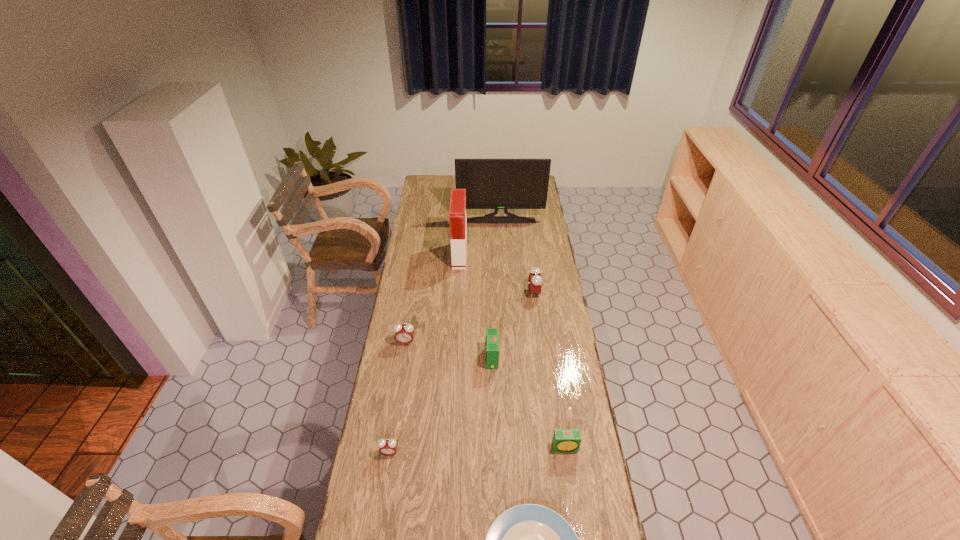
I want to click on vacant space positioned on the front-facing side of the third alarm clock from right to left, so click(x=451, y=358).

This screenshot has height=540, width=960. In order to click on free space located 0.050m on the clock face of the nearest pink alarm clock in this screenshot , I will do `click(387, 472)`.

Identify the location of free spot located 0.200m on the front-facing side of the right green alarm clock. This screenshot has height=540, width=960. (576, 516).

Image resolution: width=960 pixels, height=540 pixels. Find the location of `monitor situated at the right edge`. monitor situated at the right edge is located at coordinates (496, 184).

I want to click on blank space at the left edge, so click(x=388, y=417).

In the image, there is a desktop. At what (x,y) coordinates should I click in order to perform the action: click on vacant space at the right edge. Please return your answer as a coordinate pair (x, y). This screenshot has width=960, height=540. Looking at the image, I should click on (529, 210).

Locate an element on the screen. free space at the far left corner is located at coordinates (422, 183).

The image size is (960, 540). I want to click on vacant point located between the cigarette_case and the third farthest object, so click(497, 274).

You are a GUI agent. You are given a task and a screenshot of the screen. Output one action in this format:
    pyautogui.click(x=<x>, y=<y>)
    Task: Click on the vacant area between the cigarette_case and the farthest object
    This screenshot has height=540, width=960.
    Given the screenshot: What is the action you would take?
    pyautogui.click(x=480, y=238)

At what (x,y) coordinates should I click in order to perform the action: click on empty location between the fourth nearest object and the monitor. Please return your answer as a coordinate pair (x, y). Looking at the image, I should click on (496, 289).